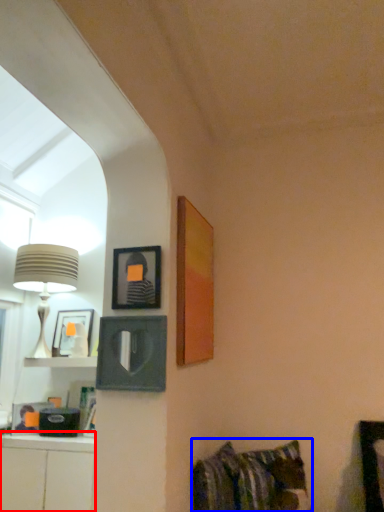
Question: Among these objects, which one is nearest to the camera, cabinetry (highlighted by a red box) or bed (highlighted by a blue box)?

Choices:
 (A) cabinetry
 (B) bed

Answer: (A)